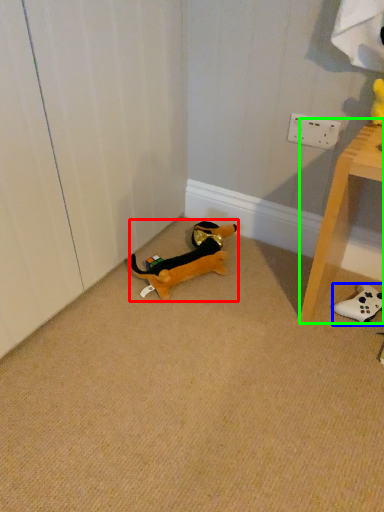
Question: Estimate the real-world distances between objects in this image. Which object is farther from toy (highlighted by a red box), toy (highlighted by a blue box) or furniture (highlighted by a green box)?

Choices:
 (A) toy
 (B) furniture

Answer: (A)